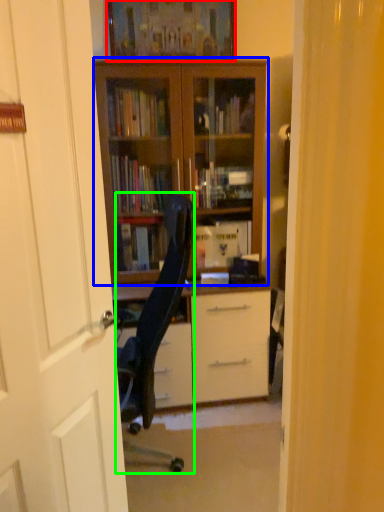
Question: Which object is positioned closest to picture frame (highlighted by a red box)? Select from bookcase (highlighted by a blue box) and chair (highlighted by a green box).

Choices:
 (A) bookcase
 (B) chair

Answer: (A)